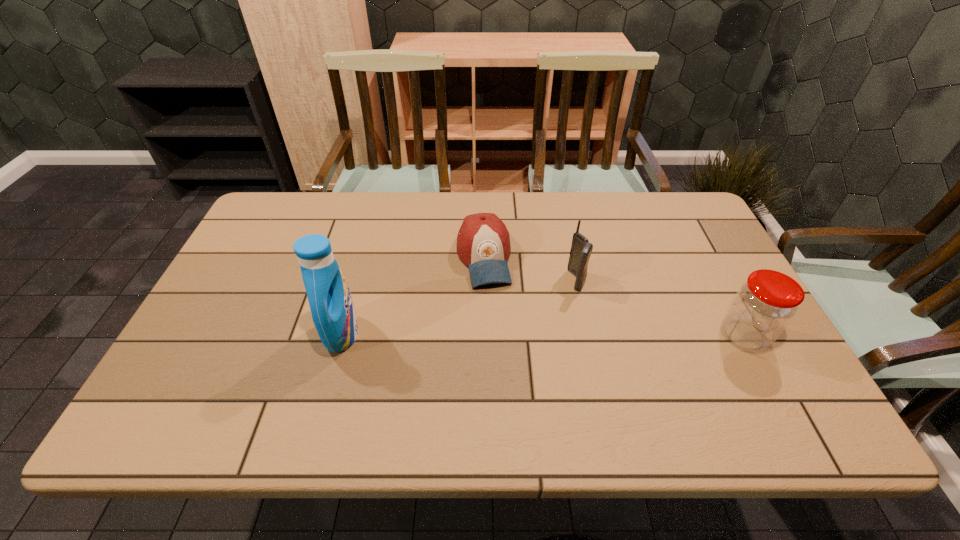
Where is `the tallest object`? the tallest object is located at coordinates (333, 313).

Find the location of `the leftmost object`. the leftmost object is located at coordinates (333, 313).

This screenshot has width=960, height=540. Find the location of `jar`. jar is located at coordinates (764, 305).

At what (x,y) coordinates should I click in order to perform the action: click on the second object from left to right. Please return your answer as a coordinate pair (x, y). The height and width of the screenshot is (540, 960). Looking at the image, I should click on (483, 243).

Locate an element on the screen. This screenshot has height=540, width=960. baseball cap is located at coordinates (483, 243).

Find the location of `cellular telephone`. cellular telephone is located at coordinates (581, 249).

Find the location of a particular element. The image size is (960, 540). vacant space situated on the front-facing side of the leftmost object is located at coordinates (451, 334).

The width and height of the screenshot is (960, 540). Identify the location of vacant space located 0.180m on the left of the jar. (646, 335).

At what (x,y) coordinates should I click in order to perform the action: click on free space located 0.210m on the front-facing side of the baseball cap. Please return your answer as a coordinate pair (x, y). The height and width of the screenshot is (540, 960). Looking at the image, I should click on (502, 354).

The height and width of the screenshot is (540, 960). I want to click on vacant point located 0.190m on the front-facing side of the baseball cap, so click(x=501, y=347).